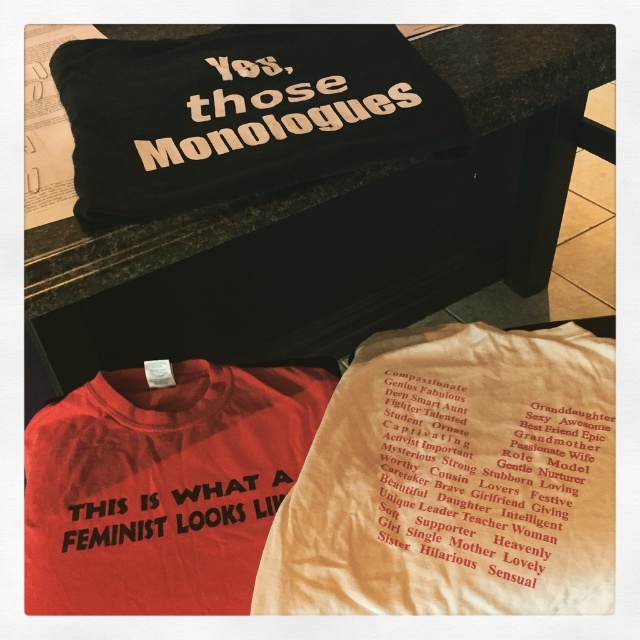
Question: In this image, where is black fabric pillow at upper center located relative to wooden text at center?

Choices:
 (A) left
 (B) right

Answer: (B)

Question: Which object is the farthest from the black fabric pillow at upper center?

Choices:
 (A) black fabric text at center
 (B) wooden text at center
 (C) white paper text at center

Answer: (C)

Question: Which object is positioned farthest from the black fabric pillow at upper center?

Choices:
 (A) red cotton t-shirt at center
 (B) white paper text at center

Answer: (B)

Question: Which point appears farthest from the camera in this image?

Choices:
 (A) (376, 100)
 (B) (112, 538)

Answer: (A)

Question: Is white paper text at center below wooden text at center?

Choices:
 (A) no
 (B) yes

Answer: (B)

Question: In this image, where is red cotton t-shirt at center located relative to white paper text at center?

Choices:
 (A) right
 (B) left

Answer: (B)